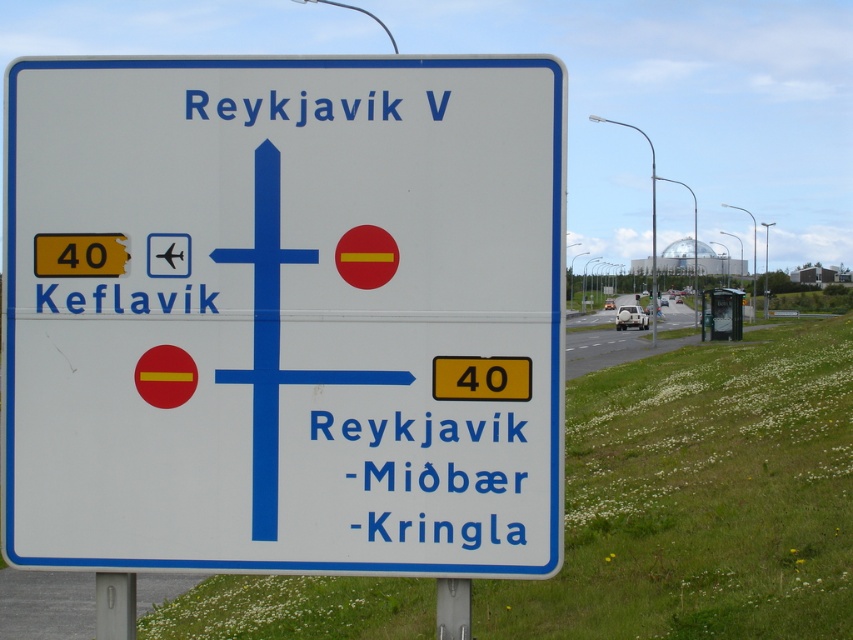
Question: Which point is farther to the camera?

Choices:
 (A) white plastic sign at center
 (B) white plastic text at upper center
 (C) black text at lower left

Answer: (C)

Question: Which object appears closest to the camera in this image?

Choices:
 (A) black text at lower left
 (B) white plastic sign at center
 (C) white plastic text at upper center
 (D) blue text at lower center

Answer: (D)

Question: Can you confirm if blue text at lower center is thinner than black text at lower left?

Choices:
 (A) no
 (B) yes

Answer: (A)

Question: Does white plastic sign at center have a lesser width compared to black text at lower left?

Choices:
 (A) yes
 (B) no

Answer: (B)

Question: Does white plastic sign at center appear on the right side of white plastic text at upper center?

Choices:
 (A) yes
 (B) no

Answer: (B)

Question: Among these points, which one is farthest from the camera?

Choices:
 (A) (132, 308)
 (B) (196, 109)

Answer: (A)